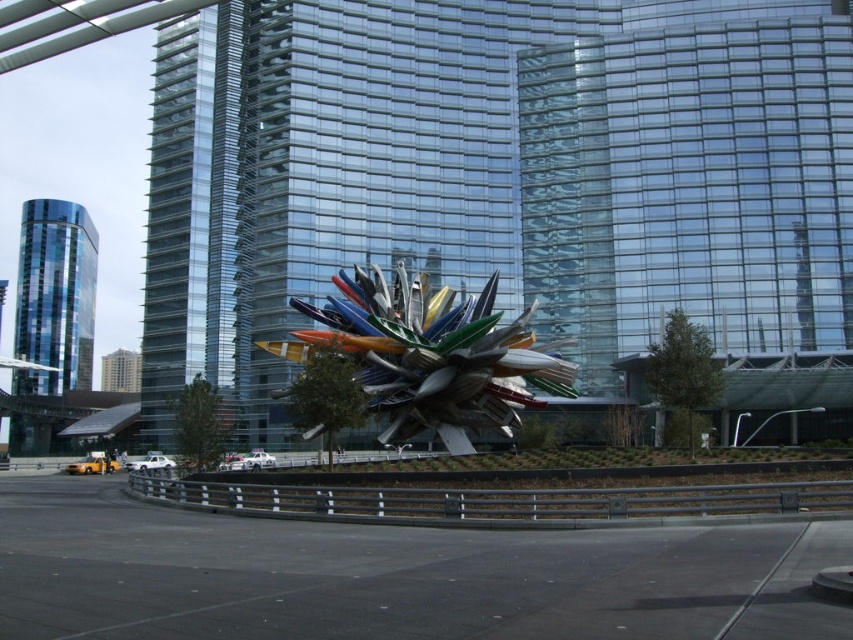
Does transparent glass tower at center appear on the left side of blue glass tower at left?

No, transparent glass tower at center is not to the left of blue glass tower at left.

The width and height of the screenshot is (853, 640). Identify the location of transparent glass tower at center. (495, 173).

Between point (676, 8) and point (68, 289), which one is positioned behind?

The point (68, 289) is behind.

Image resolution: width=853 pixels, height=640 pixels. What are the coordinates of `transparent glass tower at center` in the screenshot? It's located at (495, 173).

Identify the location of transparent glass tower at center. This screenshot has width=853, height=640. (495, 173).

Who is shorter, transparent glass tower at center or metallic multi-colored blades at center?

metallic multi-colored blades at center

Between point (809, 321) and point (357, 378), which one is positioned behind?

Positioned behind is point (809, 321).

This screenshot has width=853, height=640. I want to click on transparent glass tower at center, so pos(495,173).

Is metallic multi-colored blades at center above blue glass tower at left?

No, metallic multi-colored blades at center is not above blue glass tower at left.

Between metallic multi-colored blades at center and blue glass tower at left, which one has less height?

With less height is metallic multi-colored blades at center.

The image size is (853, 640). I want to click on metallic multi-colored blades at center, so click(x=431, y=355).

At what (x,y) coordinates should I click in order to perform the action: click on metallic multi-colored blades at center. Please return your answer as a coordinate pair (x, y). Looking at the image, I should click on (431, 355).